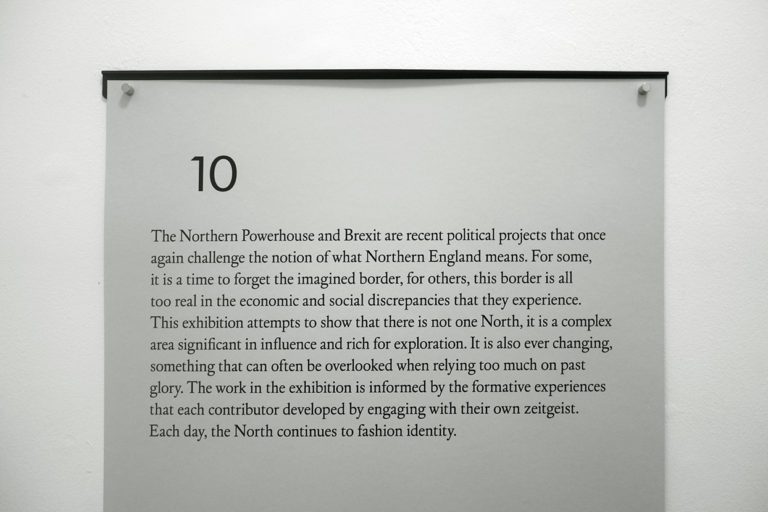
The height and width of the screenshot is (512, 768). Find the location of `thumb tack`. thumb tack is located at coordinates (127, 91), (644, 87).